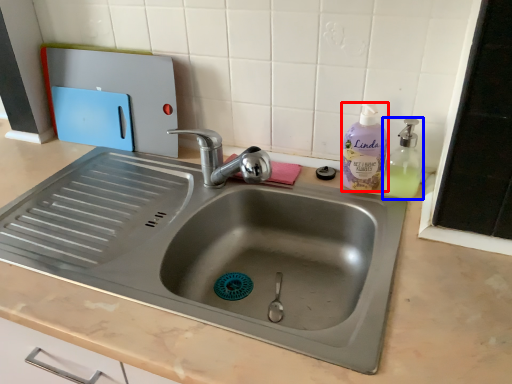
Question: Which object is closer to the camera taking this photo, cleaning product (highlighted by a red box) or soap dispenser (highlighted by a blue box)?

Choices:
 (A) cleaning product
 (B) soap dispenser

Answer: (B)